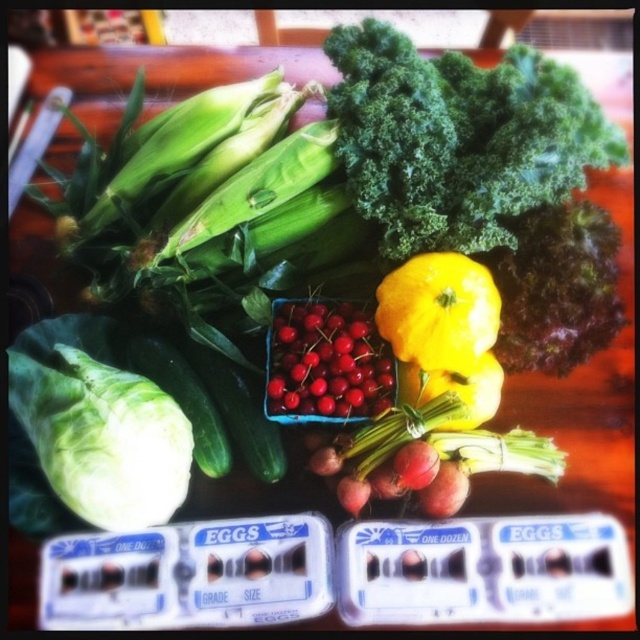
Is green leafy at left behind yellow matte squash at center?

No, green leafy at left is closer to the viewer.

Is green leafy at left bigger than yellow matte squash at center?

Yes, green leafy at left is bigger than yellow matte squash at center.

Does point (68, 364) come behind point (388, 273)?

No, it is not.

Where is `green leafy at left`? The width and height of the screenshot is (640, 640). green leafy at left is located at coordinates (104, 438).

Does shiny red berries at center have a larger size compared to yellow matte squash at center?

Indeed, shiny red berries at center has a larger size compared to yellow matte squash at center.

Is point (312, 314) farther from camera compared to point (444, 358)?

Yes, it is behind point (444, 358).

Where is `shiny red berries at center`? This screenshot has height=640, width=640. shiny red berries at center is located at coordinates (324, 364).

Between green leafy at upper center and green leafy at left, which one has more height?

With more height is green leafy at upper center.

What do you see at coordinates (458, 138) in the screenshot? The image size is (640, 640). I see `green leafy at upper center` at bounding box center [458, 138].

Identify the location of green leafy at upper center. (458, 138).